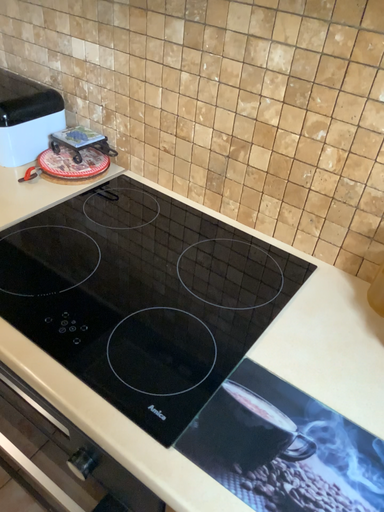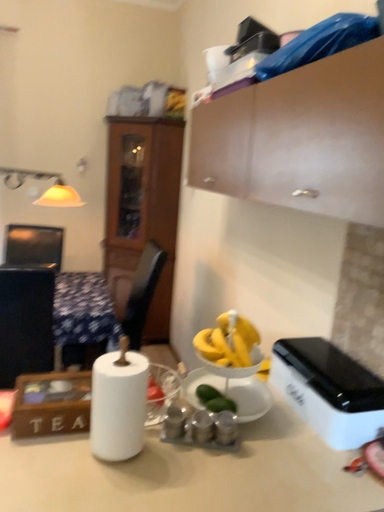
Question: Which way did the camera rotate in the video?

Choices:
 (A) rotated downward
 (B) rotated upward

Answer: (B)